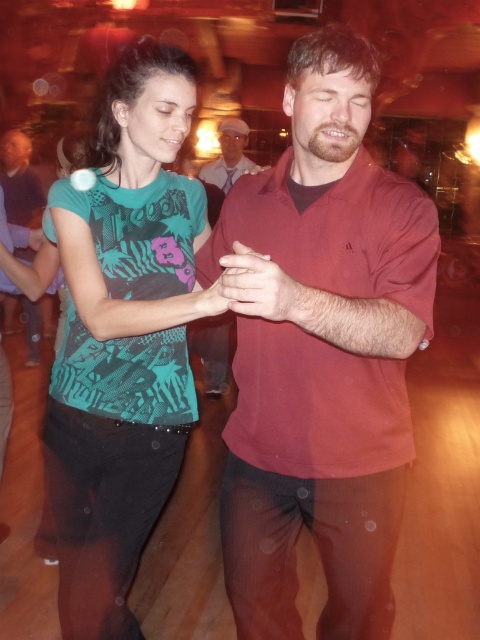
Which is more to the left, teal printed t-shirt at center or pink fabric hat at upper center?

teal printed t-shirt at center is more to the left.

Between teal printed t-shirt at center and pink fabric hat at upper center, which one appears on the right side from the viewer's perspective?

From the viewer's perspective, pink fabric hat at upper center appears more on the right side.

I want to click on teal printed t-shirt at center, so click(x=123, y=336).

Is teal printed t-shirt at center in front of matte black shirt at left?

Yes, teal printed t-shirt at center is in front of matte black shirt at left.

Where is `teal printed t-shirt at center`? teal printed t-shirt at center is located at coordinates (123, 336).

Who is positioned more to the right, matte red shirt at center or pink fabric hat at upper center?

matte red shirt at center is more to the right.

Which of these two, matte red shirt at center or pink fabric hat at upper center, stands taller?

Standing taller between the two is matte red shirt at center.

Measure the distance between matte red shirt at center and camera.

matte red shirt at center and camera are 1.15 meters apart from each other.

Identify the location of matte red shirt at center. This screenshot has height=640, width=480. (321, 353).